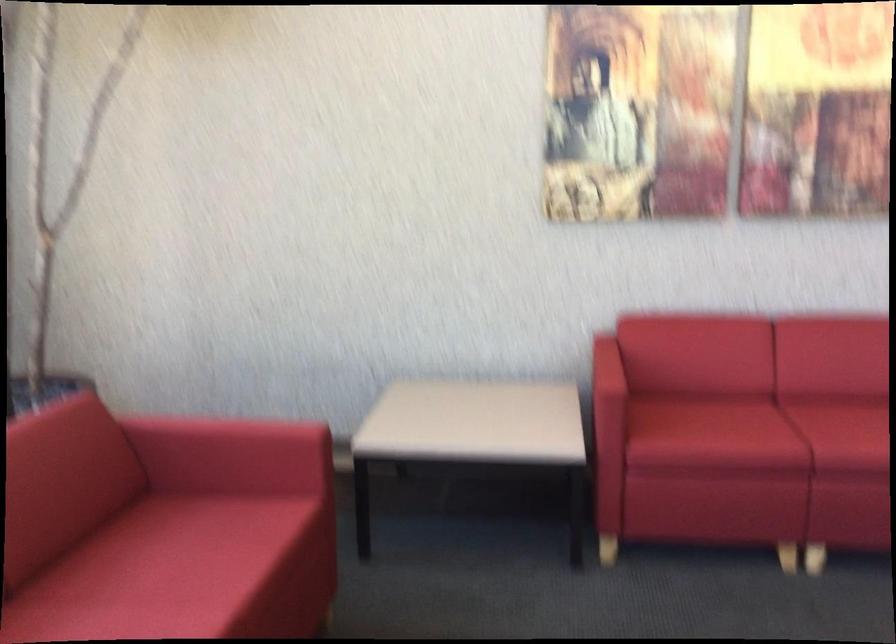
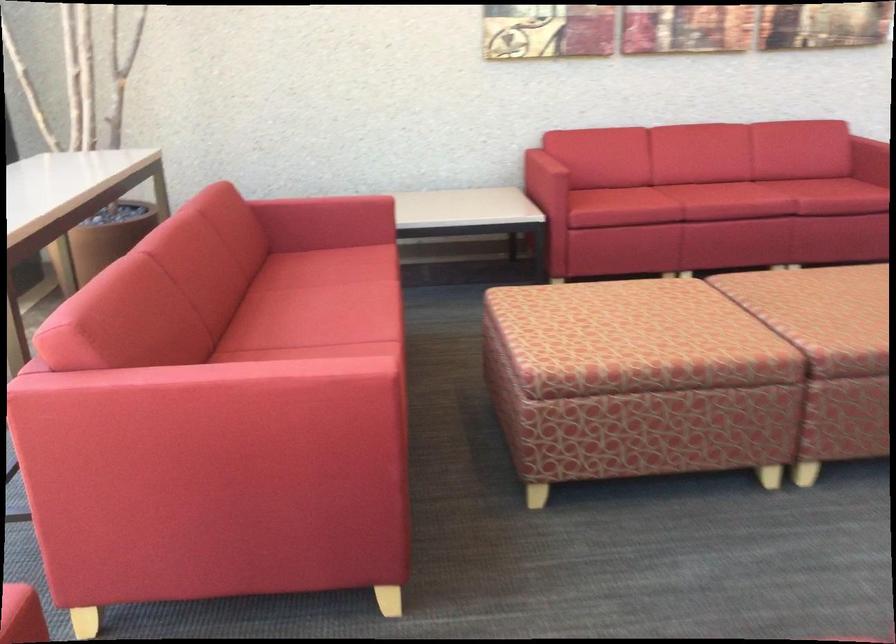
Locate, in the second image, the point that corresponds to (226,444) in the first image.

(326, 207)